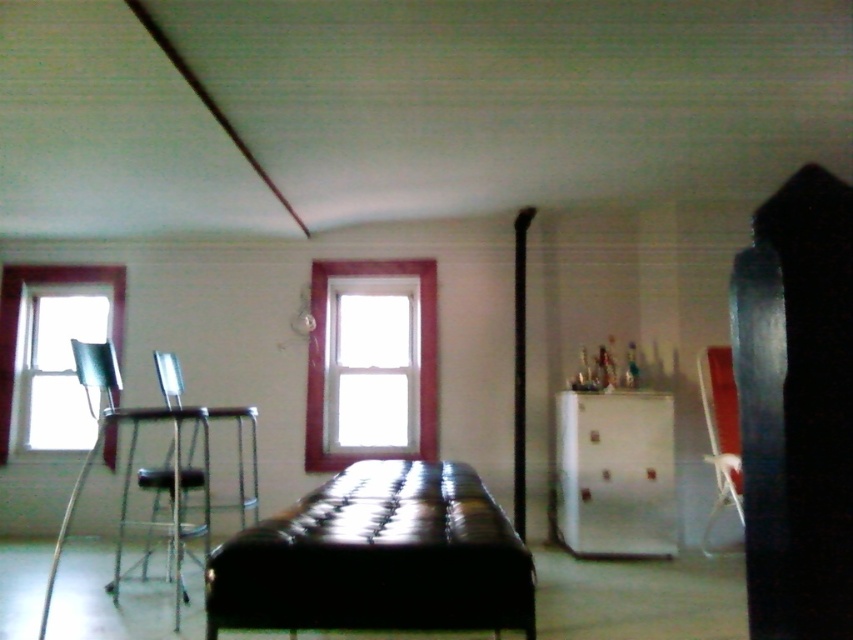
Question: Which object is the closest to the metallic silver chair at right?

Choices:
 (A) clear glass window at left
 (B) metallic silver chair at left
 (C) wooden frame window at center

Answer: (C)

Question: Does metallic silver chair at right appear over clear glass window at left?

Choices:
 (A) no
 (B) yes

Answer: (A)

Question: Which is farther from the metallic silver chair at right?

Choices:
 (A) wooden frame window at center
 (B) metallic silver chair at left
 (C) clear glass window at left

Answer: (C)

Question: Which of the following is the farthest from the observer?

Choices:
 (A) (432, 260)
 (B) (9, 349)
 (C) (703, 400)

Answer: (B)

Question: Can you confirm if black leather bed at center is smaller than clear glass window at left?

Choices:
 (A) yes
 (B) no

Answer: (B)

Question: Can you confirm if wooden frame window at center is bigger than metallic silver chair at right?

Choices:
 (A) yes
 (B) no

Answer: (B)